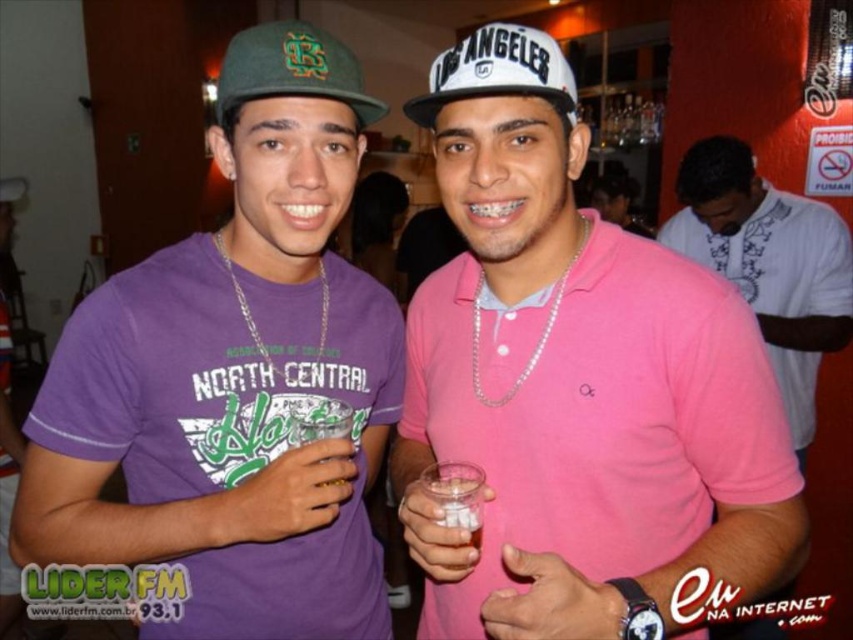
Is white matte baseball cap at center shorter than translucent plastic cup at center?

Incorrect, white matte baseball cap at center's height does not fall short of translucent plastic cup at center's.

Which is in front, point (480, 60) or point (457, 467)?

Point (480, 60) is in front.

At what (x,y) coordinates should I click in order to perform the action: click on white matte baseball cap at center. Please return your answer as a coordinate pair (x, y). Looking at the image, I should click on (497, 72).

Is green felt baseball cap at upper left bigger than white matte baseball cap at center?

Correct, green felt baseball cap at upper left is larger in size than white matte baseball cap at center.

Which is more to the left, green felt baseball cap at upper left or white matte baseball cap at center?

From the viewer's perspective, green felt baseball cap at upper left appears more on the left side.

Which is in front, point (383, 115) or point (548, 93)?

Point (548, 93)

The height and width of the screenshot is (640, 853). I want to click on green felt baseball cap at upper left, so click(x=291, y=68).

Does pink cotton shirt at center come in front of white matte baseball cap at center?

No.

Who is taller, pink cotton shirt at center or white matte baseball cap at center?

pink cotton shirt at center is taller.

Image resolution: width=853 pixels, height=640 pixels. What are the coordinates of `pink cotton shirt at center` in the screenshot? It's located at (769, 264).